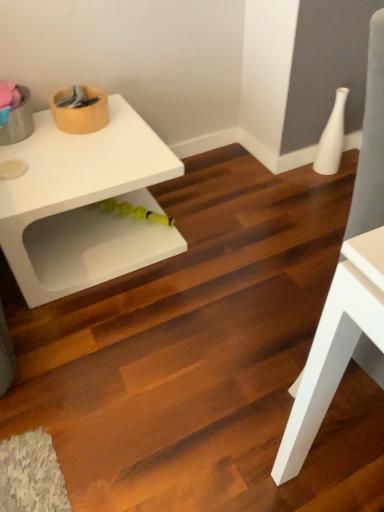
You are a GUI agent. You are given a task and a screenshot of the screen. Output one action in this format:
    pyautogui.click(x=<x>, y=<y>)
    Task: Click on the free space to the left of white glossy vase at upper right
    This screenshot has width=384, height=512.
    Given the screenshot: What is the action you would take?
    pyautogui.click(x=296, y=177)